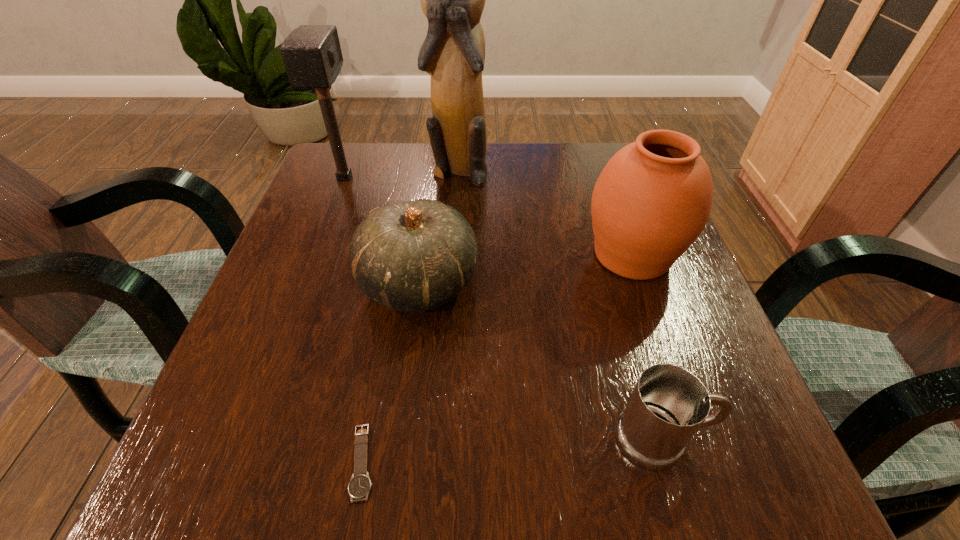
The image size is (960, 540). What are the coordinates of `free space between the watch and the gourd` in the screenshot? It's located at (391, 372).

Locate an element on the screen. vacant point located between the fifth tallest object and the fourth shortest object is located at coordinates (647, 347).

This screenshot has height=540, width=960. What are the coordinates of `free spot between the shortest object and the second shortest object` in the screenshot? It's located at (512, 450).

Image resolution: width=960 pixels, height=540 pixels. Identify the location of free space between the cat and the leftmost object. (401, 173).

This screenshot has width=960, height=540. Identify the location of free spot between the gourd and the shortest object. (391, 372).

Locate an element on the screen. The height and width of the screenshot is (540, 960). vacant area that lies between the urn and the third shortest object is located at coordinates (526, 268).

Locate an element on the screen. The width and height of the screenshot is (960, 540). empty location between the watch and the fourth tallest object is located at coordinates (391, 372).

Identify the location of the fourth closest object to the tallest object. The height and width of the screenshot is (540, 960). (360, 484).

The width and height of the screenshot is (960, 540). In order to click on object that is the fifth nearest to the fifth shortest object in this screenshot , I will do `click(669, 404)`.

Identify the location of vacant region that satisfies the following two spatial constraints: 1. on the back side of the fourth tallest object; 2. on the right side of the urn. The width and height of the screenshot is (960, 540). (423, 255).